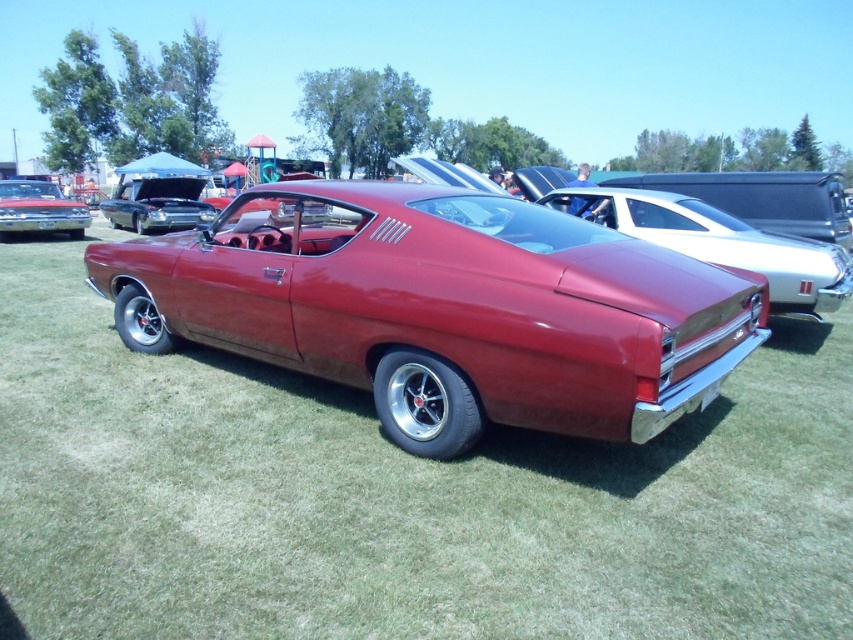
Question: Which point is closer to the camera?

Choices:
 (A) (161, 186)
 (B) (711, 554)
 (C) (798, 259)

Answer: (B)

Question: Is glossy red car at center smaller than glossy metallic car at center?

Choices:
 (A) no
 (B) yes

Answer: (B)

Question: Which of the following is the closest to the observer?

Choices:
 (A) glossy red car at center
 (B) shiny red car at center
 (C) glossy metallic car at center
 (D) shiny chrome car at upper left

Answer: (B)

Question: Is glossy red car at center further to camera compared to shiny red car at upper left?

Choices:
 (A) yes
 (B) no

Answer: (B)

Question: Which point appears closest to the camera in this image?

Choices:
 (A) (596, 472)
 (B) (643, 419)
 (C) (59, 216)
 (D) (175, 209)

Answer: (B)

Question: Does shiny red car at center appear on the right side of shiny chrome car at upper left?

Choices:
 (A) yes
 (B) no

Answer: (A)